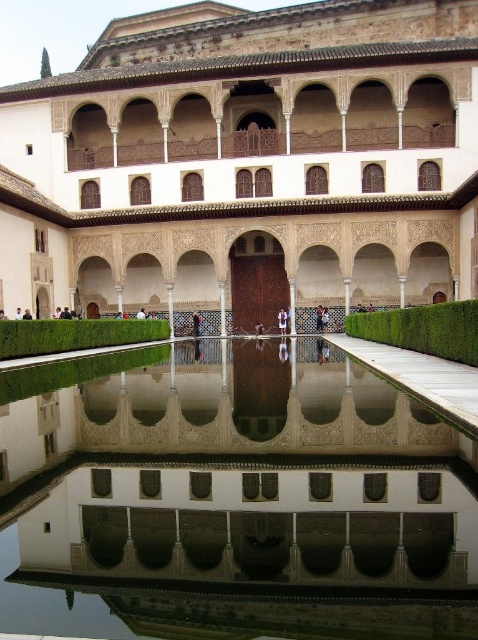
Question: Is dark blue fabric at center smaller than smooth brown wooden door at center?

Choices:
 (A) no
 (B) yes

Answer: (A)

Question: Which point is farther from the camera taking this photo?

Choices:
 (A) click(333, 456)
 (B) click(335, 74)

Answer: (B)

Question: Which of the following is the farthest from the observer?

Choices:
 (A) (323, 326)
 (B) (6, 317)

Answer: (A)

Question: Does white stone palace at center appear on the right side of brown leather jacket at center?

Choices:
 (A) yes
 (B) no

Answer: (B)

Question: Which of the following is the farthest from the observer?

Choices:
 (A) dark blue fabric at center
 (B) dark brown wooden person at center
 (C) brown leather jacket at center
 (D) light brown wooden person at center

Answer: (A)

Question: Considering the relative positions of brown leather jacket at center and smooth brown wooden door at center in the image provided, where is brown leather jacket at center located with respect to smooth brown wooden door at center?

Choices:
 (A) above
 (B) below

Answer: (B)